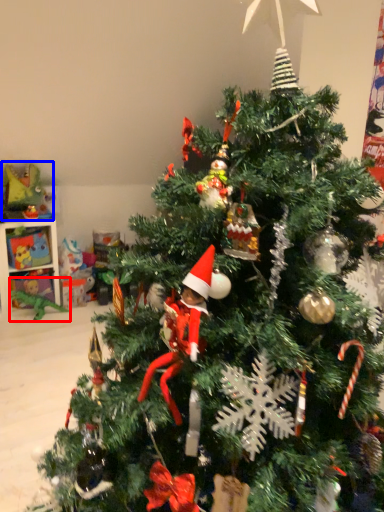
Question: Which of the following is the closest to the observer, toy (highlighted by a red box) or toy (highlighted by a blue box)?

Choices:
 (A) toy
 (B) toy

Answer: (B)